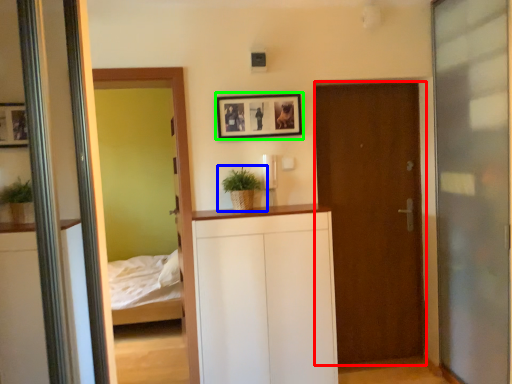
Question: Estimate the real-world distances between objects in this image. Which object is closer to door (highlighted by a red box), houseplant (highlighted by a blue box) or picture frame (highlighted by a green box)?

Choices:
 (A) houseplant
 (B) picture frame

Answer: (B)